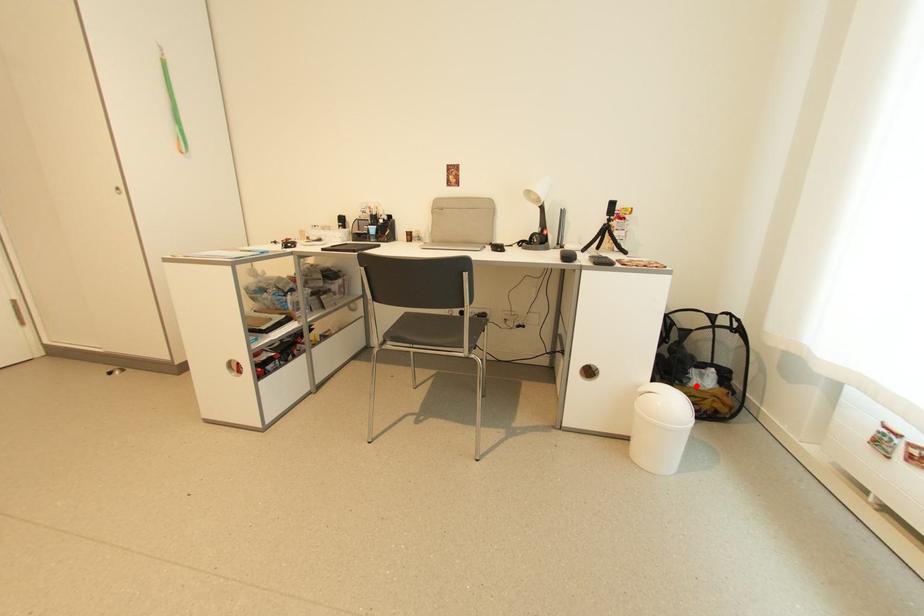
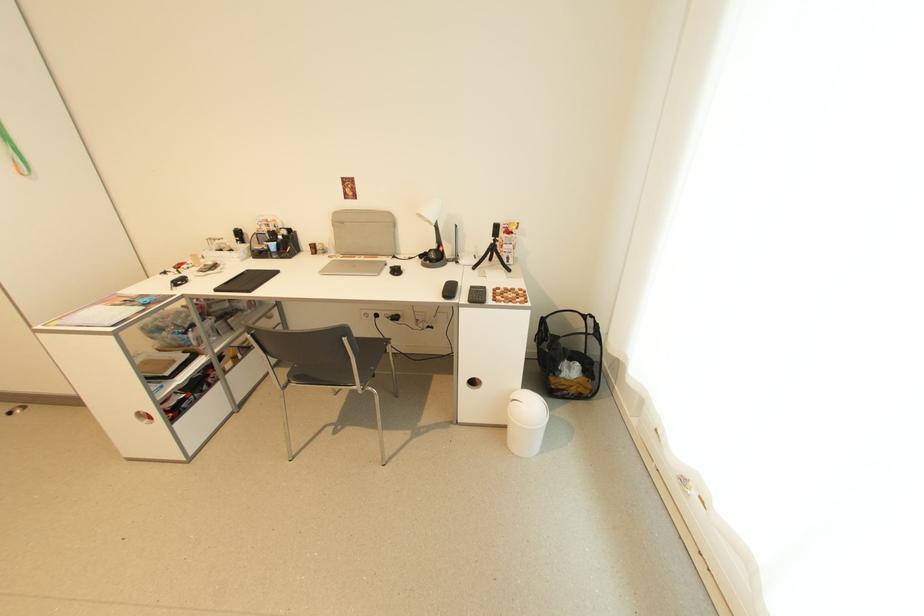
In the second image, find the point that corresponds to the highlighted location in the first image.

(566, 377)